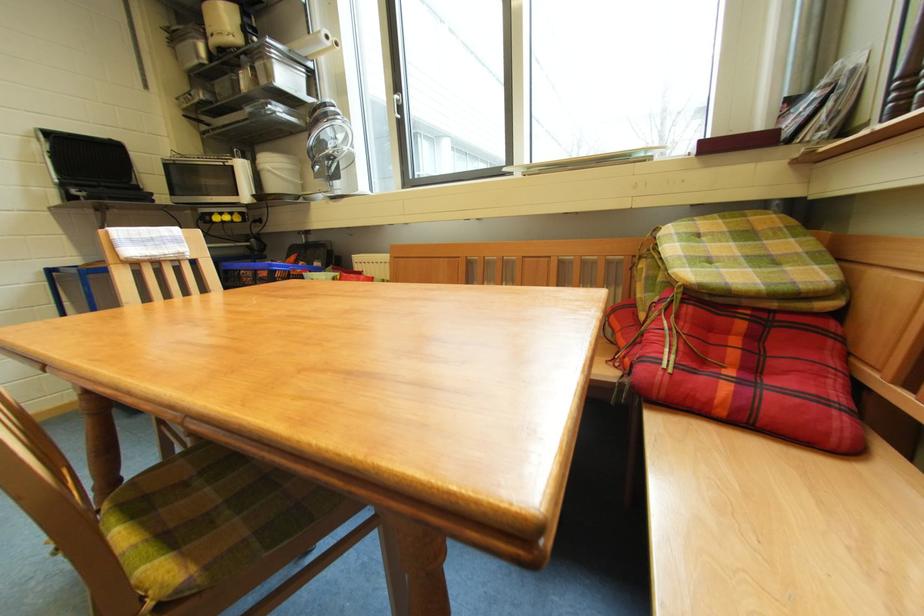
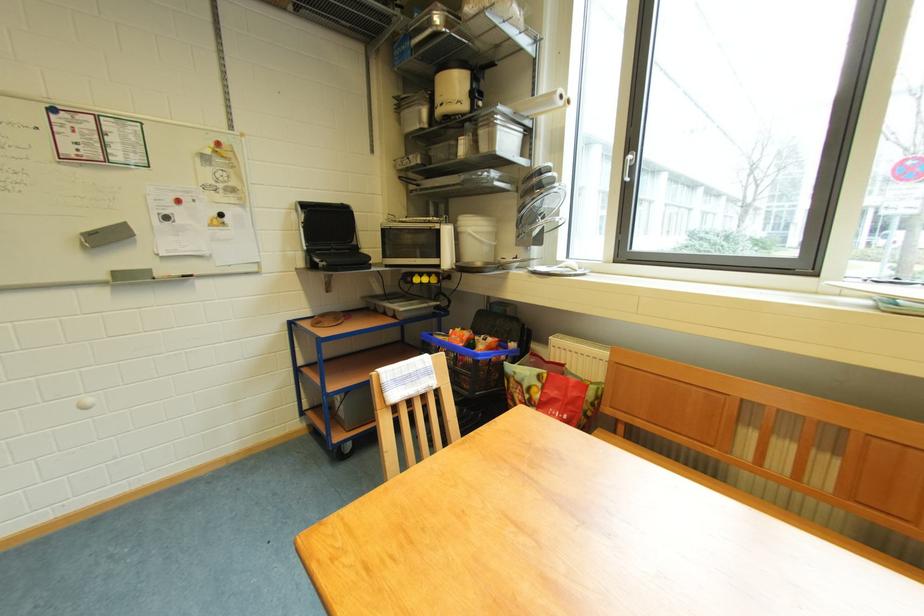
In the second image, find the point that corresponds to (x=402, y=102) in the first image.

(634, 161)